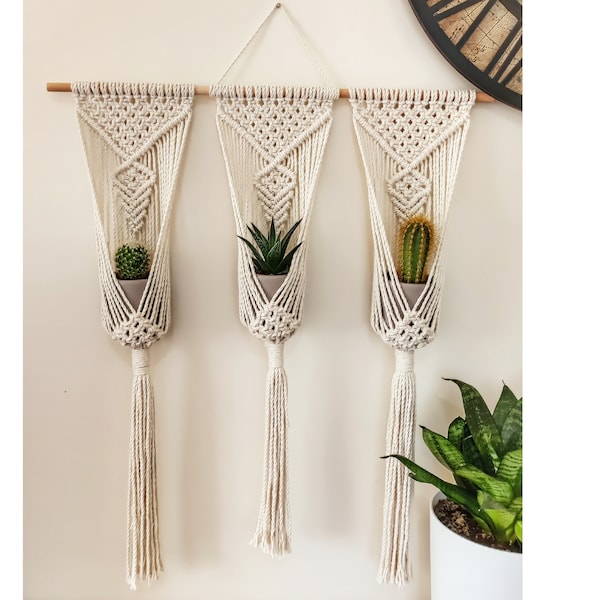
I want to click on cream colored drapes, so click(144, 445), click(276, 455), click(396, 502).